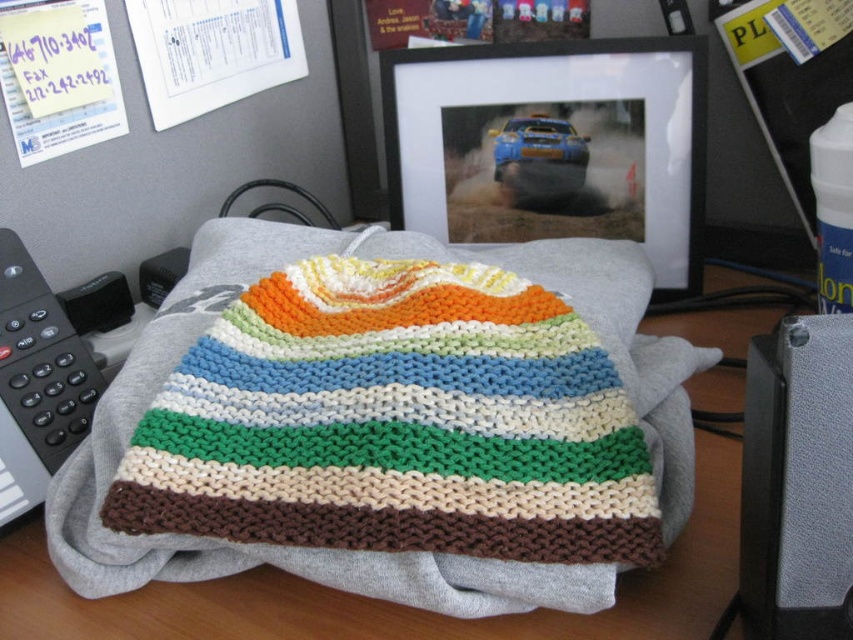
You are a delivery robot with a package that is 8 inches wide. You need to move from the gray fabric at center to the gray textured speaker at lower right. Is there enough space for your package to fit through the gap between them?

The distance between the gray fabric at center and the gray textured speaker at lower right is 7.73 inches. Since your package is 8 inches wide, it is slightly too wide to fit through the gap between them.

You are organizing a small exhibition of handmade items and need to place the gray fabric at center and the gray textured speaker at lower right on a display table. Given their positions in the image, which object is covering part of the other?

The gray fabric at center is positioned over the gray textured speaker at lower right, meaning it is covering part of the speaker.